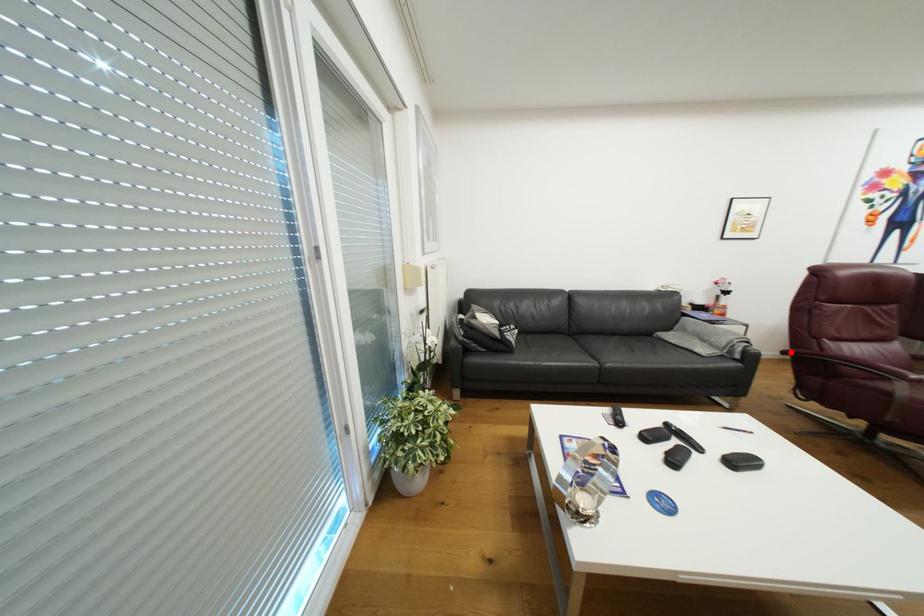
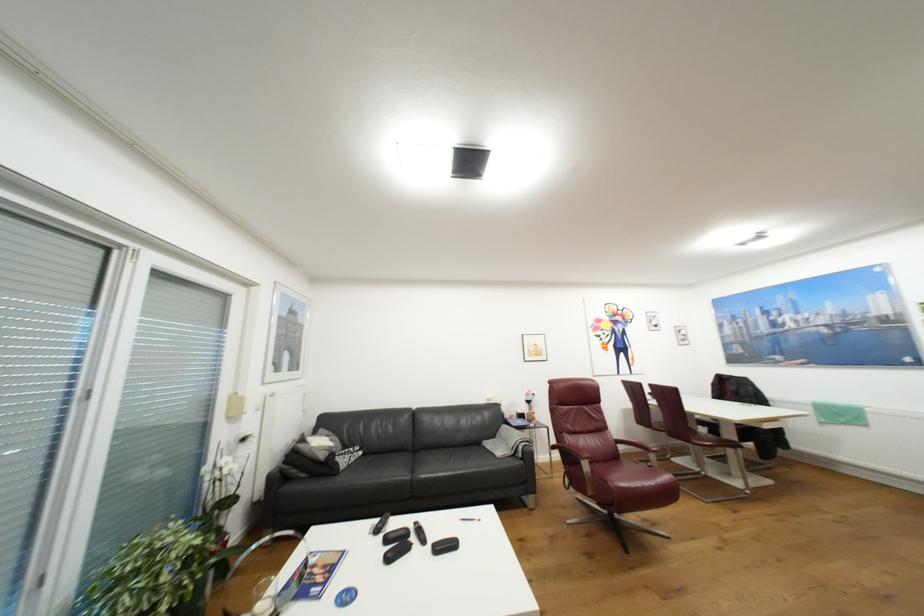
In the second image, find the point that corresponds to the highlighted location in the first image.

(560, 448)